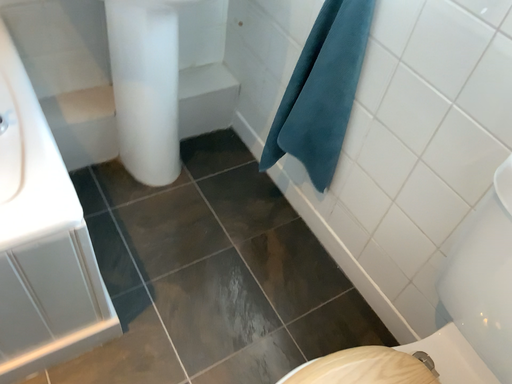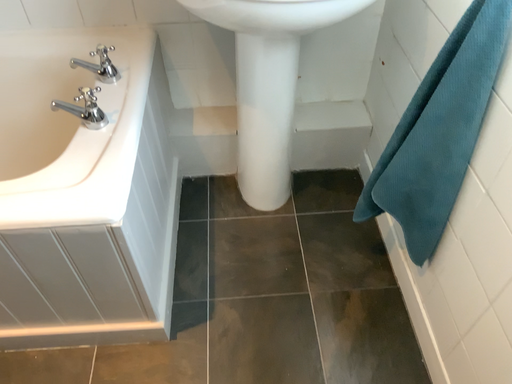
Question: How did the camera likely rotate when shooting the video?

Choices:
 (A) rotated left
 (B) rotated right

Answer: (A)